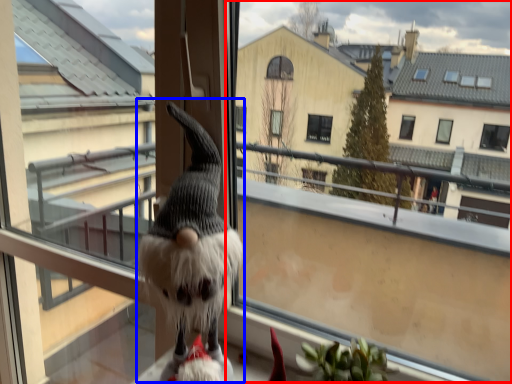
Question: Which object is further to the camera taking this photo, window screen (highlighted by a red box) or animal (highlighted by a blue box)?

Choices:
 (A) window screen
 (B) animal

Answer: (B)